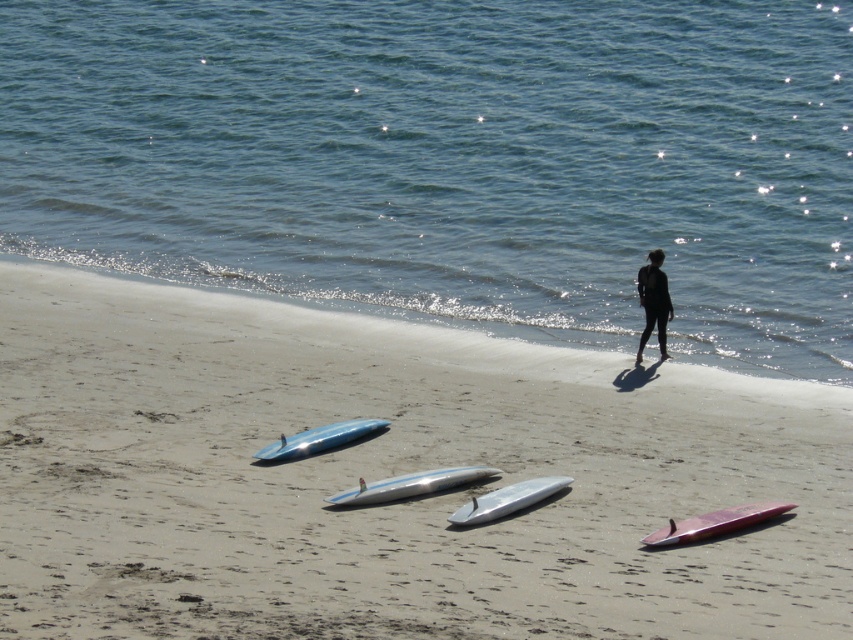
You are standing on the beach and see two points marked on the sand. The first point is at coordinates point (610, 552) and the second is at point (717, 525). Which point is closer to you?

Point (610, 552) is closer to the viewer than point (717, 525).

You are a photographer trying to capture the shiny pink surfboard at lower right. You want to ensure the smooth sand at lower center is visible in the background. Since the sand is larger than the surfboard, how should you position your camera to include both?

The smooth sand at lower center is larger in size than the shiny pink surfboard at lower right, so position the camera closer to the surfboard to ensure both the surfboard and the sand are visible with the sand as the background.

You are a photographer planning to capture the smooth sand at lower center and the black matte wetsuit at center in a single frame. Since you want to focus on the sand, which object should you position closer to the camera to ensure it takes up more of the frame?

The smooth sand at lower center should be positioned closer to the camera because its width is larger than the black matte wetsuit at center, allowing it to dominate the frame when focused on.